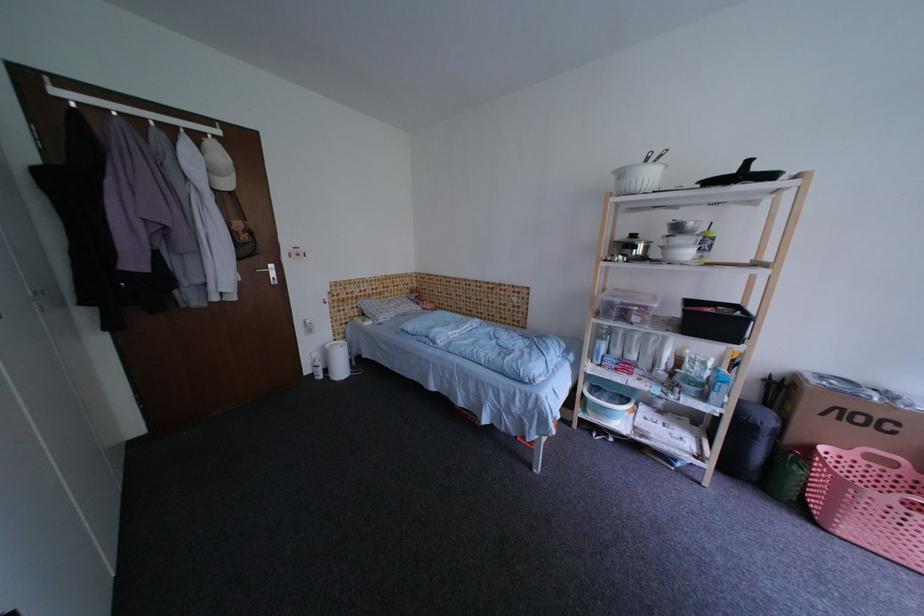
In order to click on pot handle in this screenshot , I will do `click(746, 164)`.